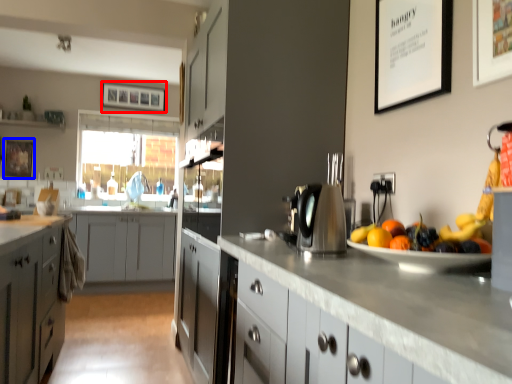
Question: Among these objects, which one is farthest to the camera, picture frame (highlighted by a red box) or picture frame (highlighted by a blue box)?

Choices:
 (A) picture frame
 (B) picture frame

Answer: (A)